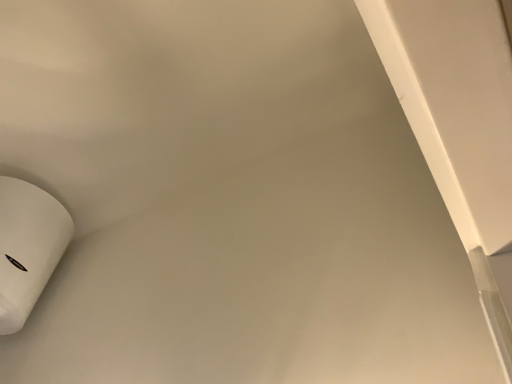
The image size is (512, 384). In order to click on white matte toilet paper at lower left in this screenshot , I will do `click(28, 247)`.

What is the approximate height of white matte toilet paper at lower left?

white matte toilet paper at lower left is 23.74 inches in height.

What is the approximate width of white matte toilet paper at lower left?

It is 18.72 inches.

What do you see at coordinates (28, 247) in the screenshot? I see `white matte toilet paper at lower left` at bounding box center [28, 247].

Locate an element on the screen. The height and width of the screenshot is (384, 512). white matte toilet paper at lower left is located at coordinates (28, 247).